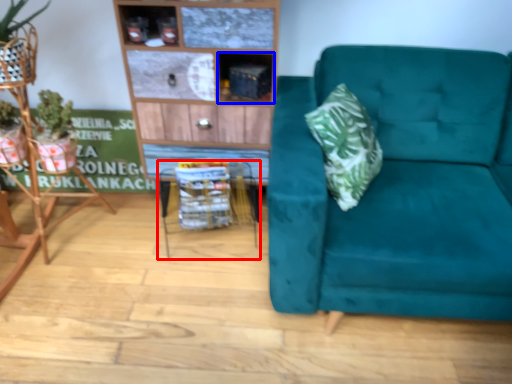
Question: Which point is closer to the camera, table (highlighted by a red box) or cabinet (highlighted by a blue box)?

Choices:
 (A) table
 (B) cabinet

Answer: (B)